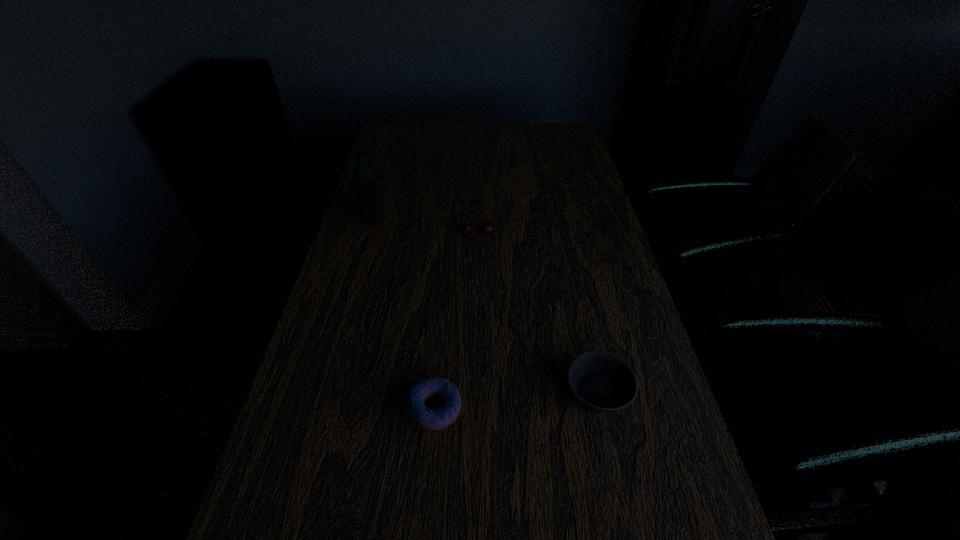
Image resolution: width=960 pixels, height=540 pixels. I want to click on the farthest object, so click(365, 176).

Locate an element on the screen. This screenshot has width=960, height=540. the leftmost object is located at coordinates (365, 176).

Identify the location of the second tallest object. (487, 228).

The width and height of the screenshot is (960, 540). Identify the location of the third nearest object. (487, 228).

The height and width of the screenshot is (540, 960). I want to click on the rightmost object, so click(x=600, y=381).

What are the coordinates of `doughnut` in the screenshot? It's located at (432, 420).

Locate an element on the screen. This screenshot has width=960, height=540. vacant space located 0.380m on the back of the leftmost object is located at coordinates (394, 153).

The height and width of the screenshot is (540, 960). What are the coordinates of `vacant space located 0.270m with stems pointing upwards on the cherry` in the screenshot? It's located at (477, 308).

Identify the location of vacant area situated 0.230m on the left of the rightmost object. 454,392.

Where is `vacant region located on the right of the doughnut`? The width and height of the screenshot is (960, 540). vacant region located on the right of the doughnut is located at coordinates (531, 409).